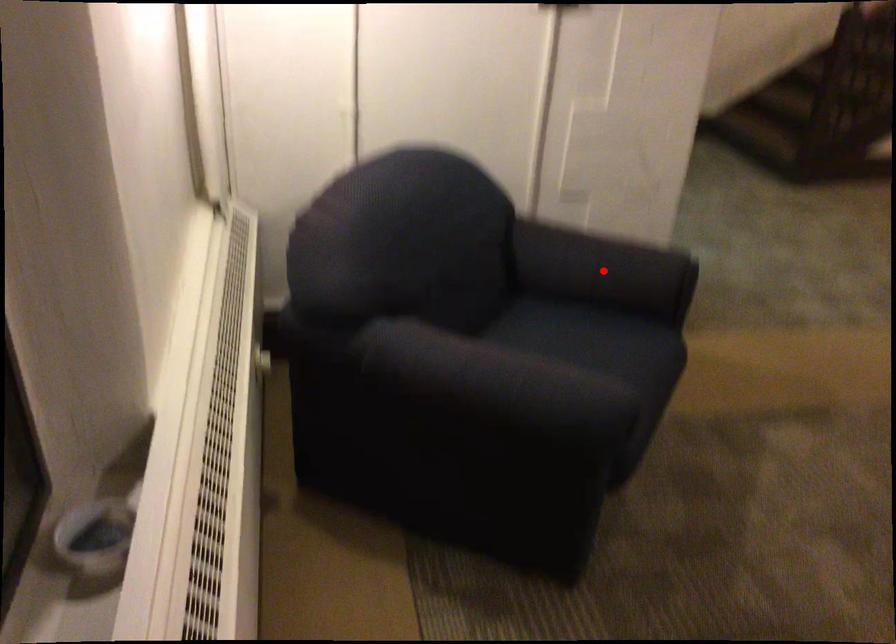
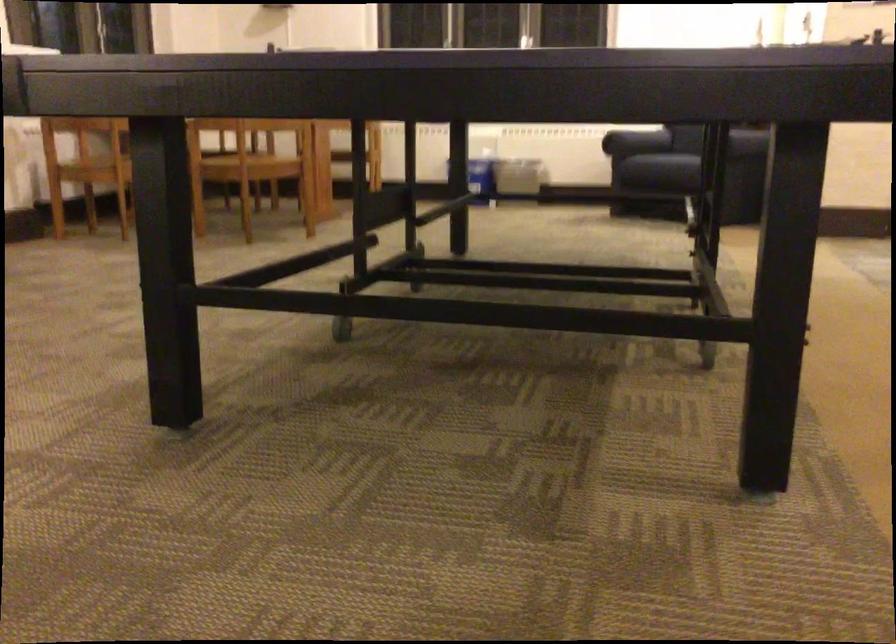
Question: I am providing you with two images of the same scene from different viewpoints. A red point is marked on the first image. Is the red point's position out of view in image 2?

Choices:
 (A) Yes
 (B) No

Answer: (A)